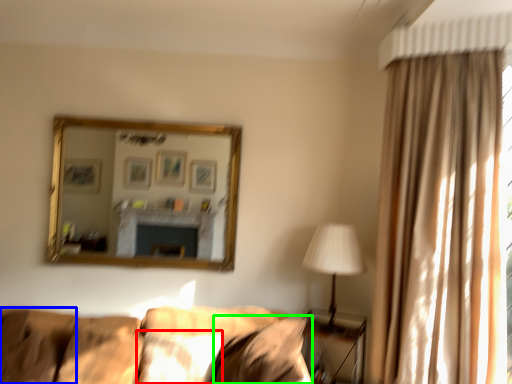
Question: Which object is positioned farthest from pillow (highlighted by a red box)? Select from pillow (highlighted by a blue box) and pillow (highlighted by a green box).

Choices:
 (A) pillow
 (B) pillow

Answer: (A)